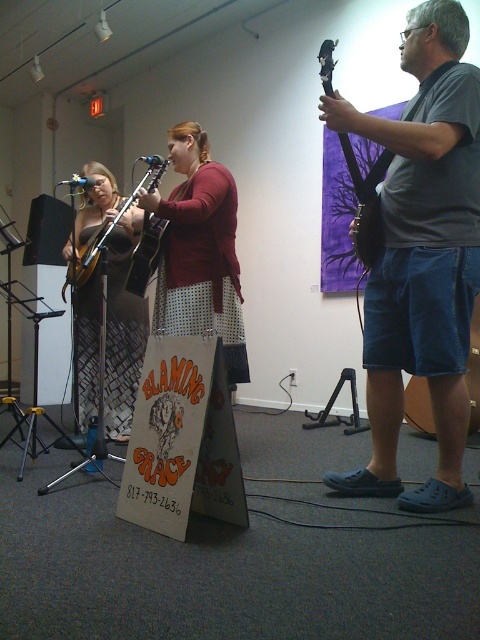
Which is below, glossy black guitar at upper center or matte brown acoustic guitar at left?

Positioned lower is matte brown acoustic guitar at left.

Based on the photo, is glossy black guitar at upper center in front of matte brown acoustic guitar at left?

Yes, it is in front of matte brown acoustic guitar at left.

Does point (372, 241) come closer to viewer compared to point (117, 221)?

Yes, it is in front of point (117, 221).

Identify the location of glossy black guitar at upper center. (365, 202).

Does gray cotton t-shirt at center appear under glossy black guitar at upper center?

Yes, gray cotton t-shirt at center is below glossy black guitar at upper center.

Who is lower down, gray cotton t-shirt at center or glossy black guitar at upper center?

gray cotton t-shirt at center

Where is `gray cotton t-shirt at center`? gray cotton t-shirt at center is located at coordinates (x=420, y=282).

Locate an element on the screen. This screenshot has height=640, width=480. gray cotton t-shirt at center is located at coordinates (420, 282).

Who is lower down, glossy black guitar at upper center or matte black guitar at lower right?

matte black guitar at lower right is lower down.

Identify the location of glossy black guitar at upper center. Image resolution: width=480 pixels, height=640 pixels. (365, 202).

Find the location of a particular element. The image size is (480, 640). glossy black guitar at upper center is located at coordinates (365, 202).